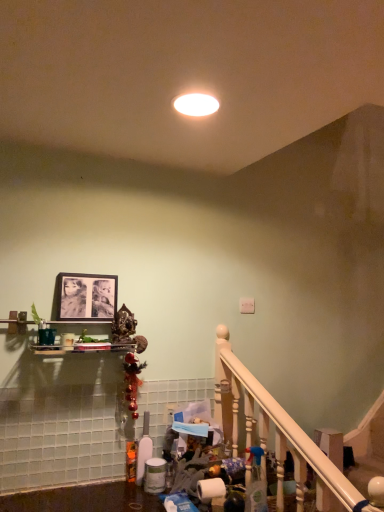
Question: Does white wooden railing at lower right touch white glossy light fixture at center?

Choices:
 (A) no
 (B) yes

Answer: (A)

Question: From a real-world perspective, is white wooden railing at lower right on top of white glossy light fixture at center?

Choices:
 (A) yes
 (B) no

Answer: (B)

Question: Considering the relative sizes of white wooden railing at lower right and white glossy light fixture at center in the image provided, is white wooden railing at lower right wider than white glossy light fixture at center?

Choices:
 (A) yes
 (B) no

Answer: (B)

Question: Is white wooden railing at lower right aimed at white glossy light fixture at center?

Choices:
 (A) yes
 (B) no

Answer: (B)

Question: Is white wooden railing at lower right positioned before white glossy light fixture at center?

Choices:
 (A) yes
 (B) no

Answer: (A)

Question: Is matte black picture frame at upper center wider or thinner than white glossy light fixture at center?

Choices:
 (A) wide
 (B) thin

Answer: (B)

Question: From a real-world perspective, relative to white glossy light fixture at center, is matte black picture frame at upper center vertically above or below?

Choices:
 (A) below
 (B) above

Answer: (A)

Question: Would you say matte black picture frame at upper center is inside or outside white glossy light fixture at center?

Choices:
 (A) outside
 (B) inside

Answer: (A)

Question: Considering their positions, is matte black picture frame at upper center located in front of or behind white glossy light fixture at center?

Choices:
 (A) behind
 (B) front

Answer: (A)

Question: From their relative heights in the image, would you say clear plastic spray bottle at lower center is taller or shorter than white glossy light fixture at center?

Choices:
 (A) tall
 (B) short

Answer: (A)

Question: Would you say clear plastic spray bottle at lower center is to the left or to the right of white glossy light fixture at center in the picture?

Choices:
 (A) left
 (B) right

Answer: (B)

Question: Relative to white glossy light fixture at center, is clear plastic spray bottle at lower center in front or behind?

Choices:
 (A) behind
 (B) front

Answer: (A)

Question: From a real-world perspective, is clear plastic spray bottle at lower center positioned above or below white glossy light fixture at center?

Choices:
 (A) below
 (B) above

Answer: (A)

Question: Relative to white wooden railing at lower right, is white glossy light fixture at center in front or behind?

Choices:
 (A) behind
 (B) front

Answer: (A)

Question: Looking at the image, does white glossy light fixture at center seem bigger or smaller compared to white wooden railing at lower right?

Choices:
 (A) big
 (B) small

Answer: (B)